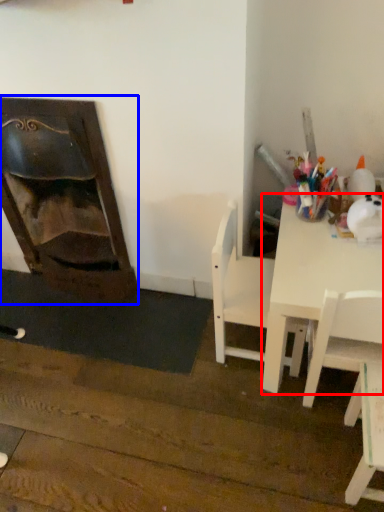
Question: Which object is closer to the camera taking this photo, table (highlighted by a red box) or fireplace (highlighted by a blue box)?

Choices:
 (A) table
 (B) fireplace

Answer: (A)